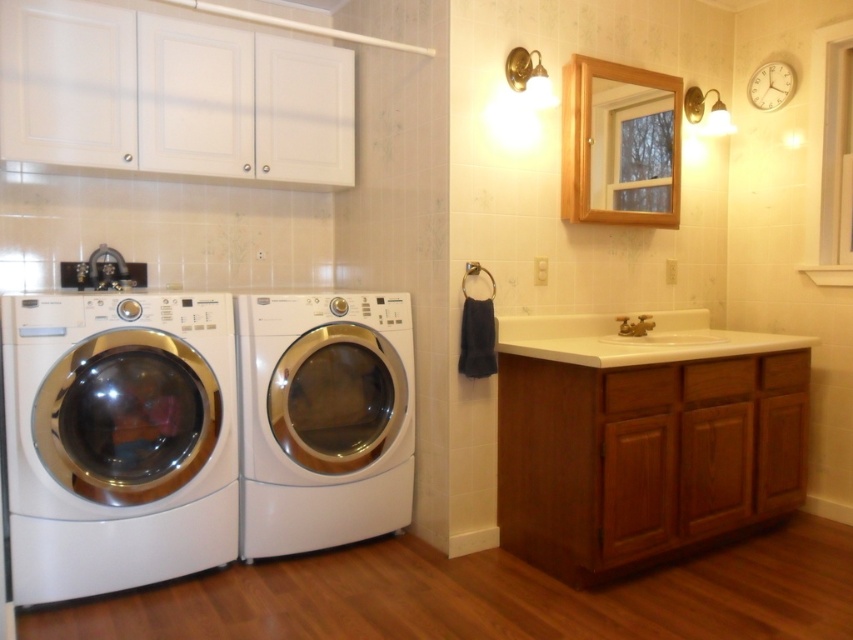
Looking at this image, is white glossy washing machine at lower left taller than white glossy sink at center?

Indeed, white glossy washing machine at lower left has a greater height compared to white glossy sink at center.

Is white glossy washing machine at lower left further to camera compared to white glossy sink at center?

That is False.

Who is more forward, (48, 518) or (718, 339)?

Positioned in front is point (48, 518).

At what (x,y) coordinates should I click in order to perform the action: click on white glossy washing machine at lower left. Please return your answer as a coordinate pair (x, y). Image resolution: width=853 pixels, height=640 pixels. Looking at the image, I should click on (119, 440).

This screenshot has width=853, height=640. Identify the location of white glossy washing machine at lower left. pyautogui.click(x=119, y=440).

Is white glossy washing machine at lower left below white glossy washing machine at center?

Incorrect, white glossy washing machine at lower left is not positioned below white glossy washing machine at center.

Is point (54, 600) farther from viewer compared to point (372, 524)?

No, it is not.

The height and width of the screenshot is (640, 853). What are the coordinates of `white glossy washing machine at lower left` in the screenshot? It's located at (119, 440).

In the scene shown: Who is more forward, (292, 337) or (691, 340)?

Point (292, 337) is more forward.

Does white glossy washing machine at center have a smaller size compared to white glossy sink at center?

No, white glossy washing machine at center is not smaller than white glossy sink at center.

Does point (383, 515) lie behind point (665, 314)?

No, (383, 515) is in front of (665, 314).

I want to click on white glossy washing machine at center, so click(323, 419).